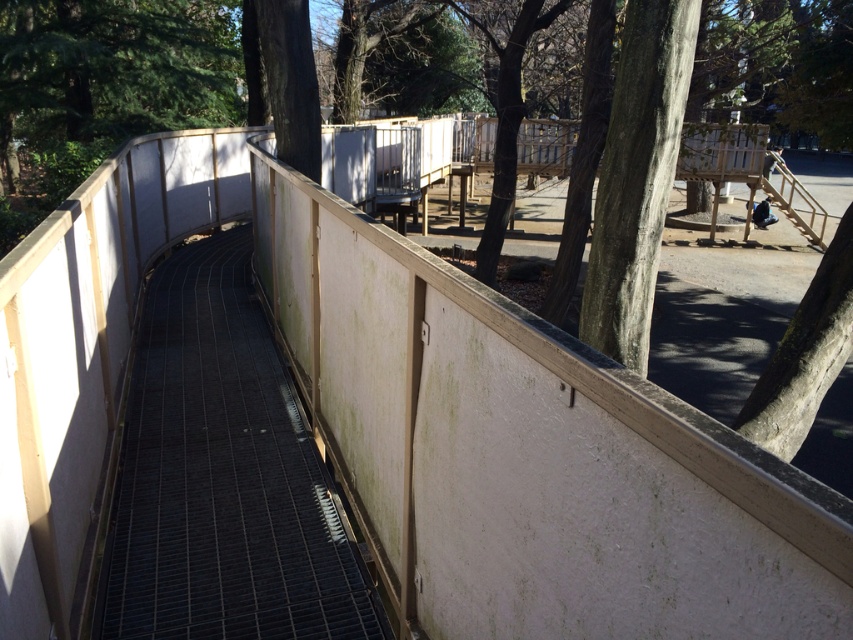
Who is more forward, (129, 426) or (683, 88)?

Point (683, 88) is more forward.

Is point (178, 330) in front of point (631, 340)?

That is False.

Find the location of a particular element. This screenshot has height=640, width=853. metal grid walkway at center is located at coordinates (222, 476).

Is gray textured tree trunk at center taller than dark brown bark at upper center?

In fact, gray textured tree trunk at center may be shorter than dark brown bark at upper center.

From the picture: Does gray textured tree trunk at center have a lesser height compared to dark brown bark at upper center?

Indeed, gray textured tree trunk at center has a lesser height compared to dark brown bark at upper center.

Does point (570, 180) lie behind point (293, 163)?

Yes.

The image size is (853, 640). What are the coordinates of `gray textured tree trunk at center` in the screenshot? It's located at (637, 177).

In the scene shown: Who is higher up, metal grid walkway at center or dark brown bark at upper center?

Positioned higher is dark brown bark at upper center.

Is metal grid walkway at center closer to camera compared to dark brown bark at upper center?

Yes.

Is point (218, 627) closer to viewer compared to point (289, 148)?

That is True.

Identify the location of metal grid walkway at center. (222, 476).